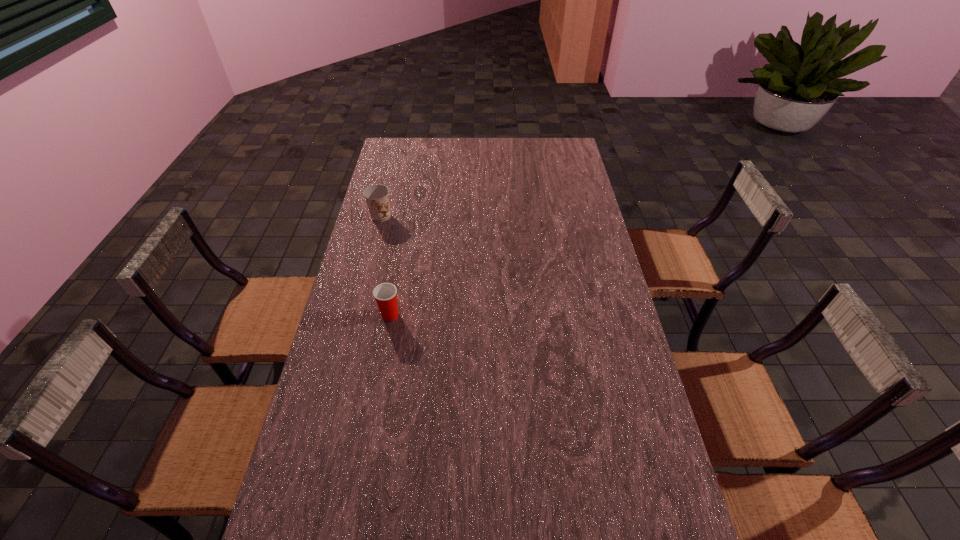
Find the location of a particular element. This screenshot has height=540, width=960. the shortest object is located at coordinates click(630, 481).

Locate an element on the screen. Image resolution: width=960 pixels, height=540 pixels. vacant space located on the back of the second blue detergent from left to right is located at coordinates (469, 172).

This screenshot has width=960, height=540. Identify the location of free space located on the right of the left white detergent. (559, 244).

In order to click on vacant space positioned on the front of the leftmost blue detergent in this screenshot , I will do `click(405, 348)`.

Image resolution: width=960 pixels, height=540 pixels. I want to click on free space located on the back of the right white detergent, so click(x=557, y=197).

This screenshot has height=540, width=960. In order to click on vacant space located on the front of the rightmost blue detergent in this screenshot , I will do `click(636, 466)`.

At what (x,y) coordinates should I click in order to perform the action: click on free region located on the front-facing side of the radio receiver. Please return your answer as a coordinate pair (x, y). This screenshot has width=960, height=540. Looking at the image, I should click on (398, 361).

This screenshot has height=540, width=960. I want to click on blank area located 0.240m on the front-facing side of the radio receiver, so click(x=396, y=361).

The image size is (960, 540). I want to click on vacant area situated on the front-facing side of the radio receiver, so click(x=458, y=361).

The height and width of the screenshot is (540, 960). I want to click on free space located on the left of the seventh farthest object, so click(x=503, y=489).